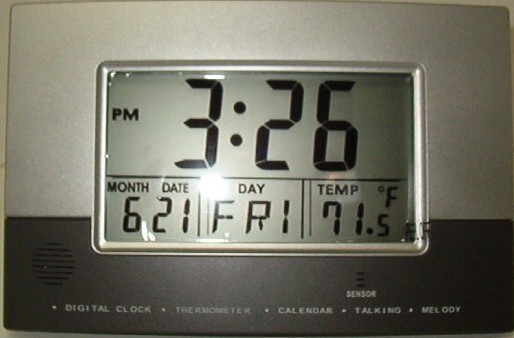
This screenshot has height=338, width=514. Find the location of `clock`. clock is located at coordinates (318, 132).